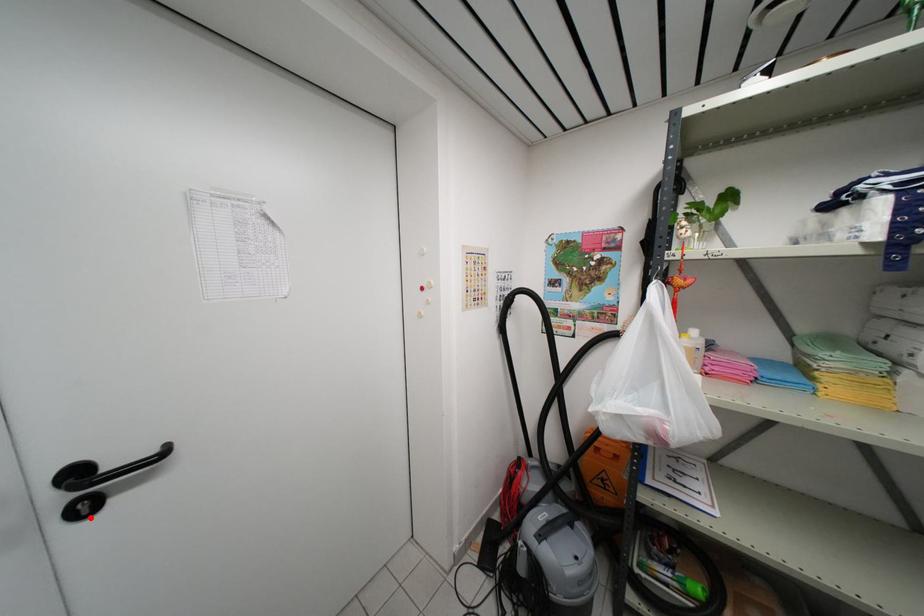
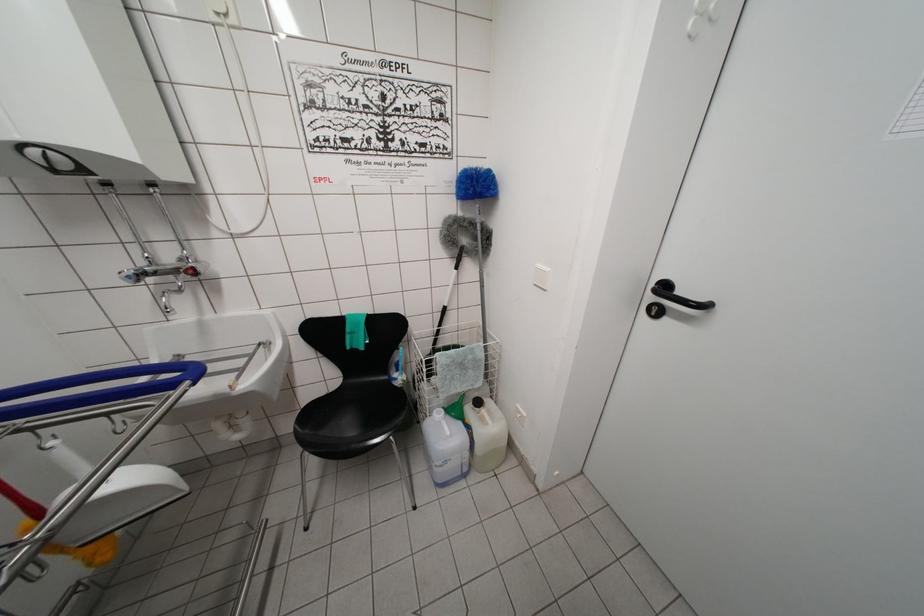
In the second image, find the point that corresponds to the highlighted location in the first image.

(657, 318)